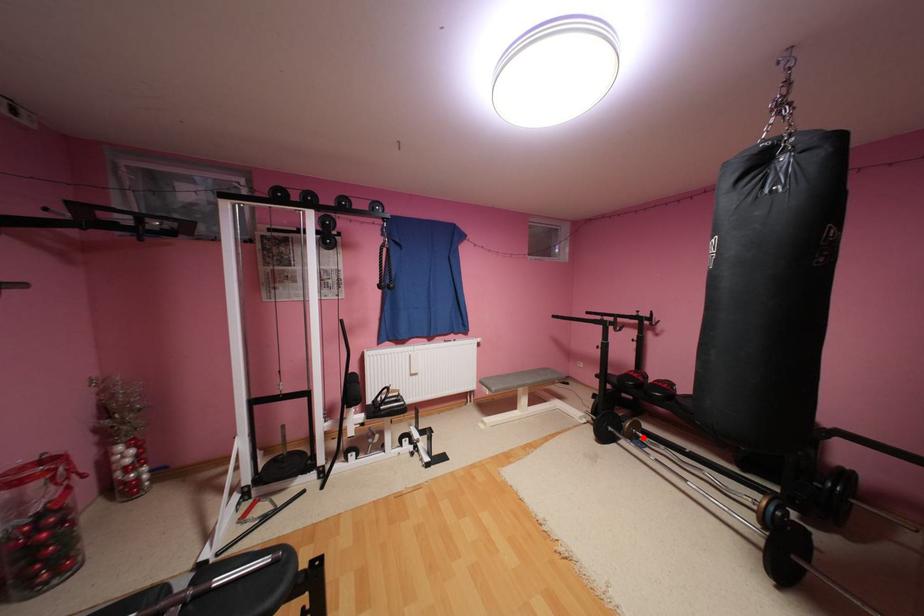
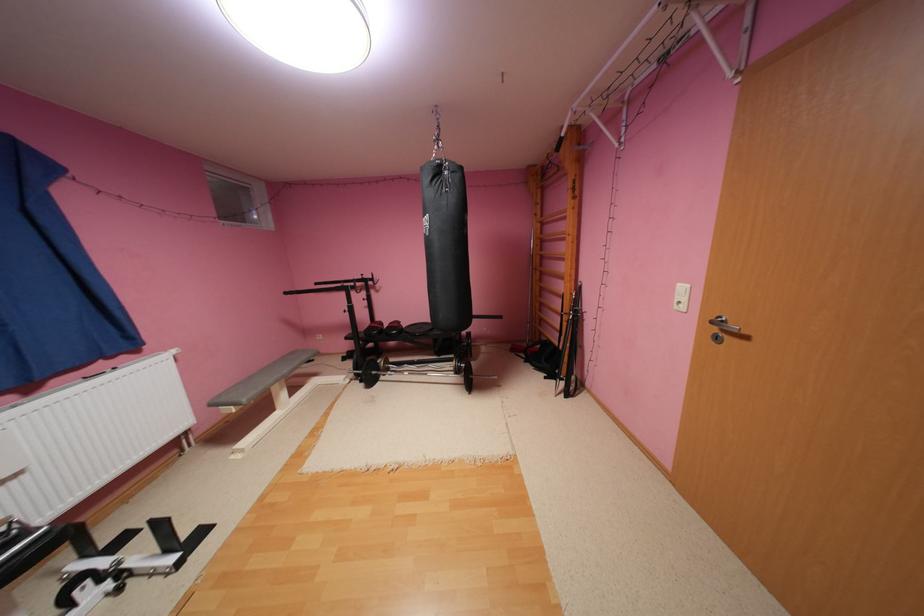
Locate, in the second image, the point that corresponds to the highlighted location in the first image.

(396, 371)